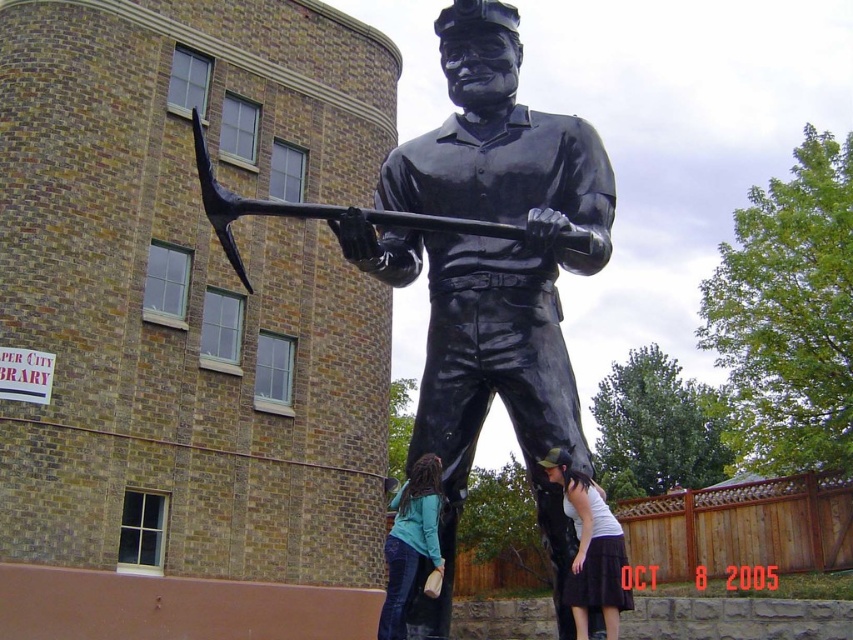
Question: Which point is closer to the camera taking this photo?

Choices:
 (A) (425, 541)
 (B) (279, 205)

Answer: (B)

Question: Which of the following is the closest to the observer?

Choices:
 (A) (613, 589)
 (B) (410, 596)
 (C) (561, 150)
 (D) (456, 228)

Answer: (D)

Question: Which object is the closest to the white fabric shirt at lower center?

Choices:
 (A) black glossy pickaxe at center
 (B) denim pants at lower center

Answer: (B)

Question: Is white fabric shirt at lower center below black glossy pickaxe at center?

Choices:
 (A) no
 (B) yes

Answer: (B)

Question: Does white fabric shirt at lower center lie behind black glossy pickaxe at center?

Choices:
 (A) no
 (B) yes

Answer: (B)

Question: Observing the image, what is the correct spatial positioning of black glossy statue at center in reference to black glossy pickaxe at center?

Choices:
 (A) right
 (B) left

Answer: (B)